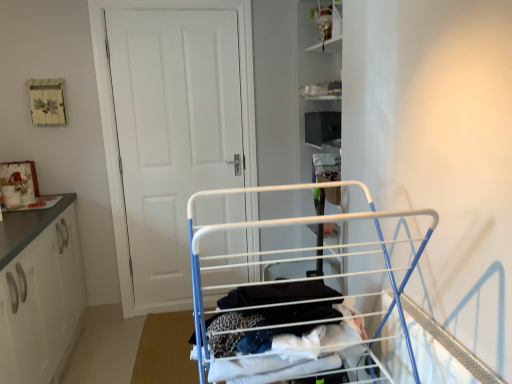
Question: From a real-world perspective, is white metal drying rack at center located higher than white fabric clothes at center?

Choices:
 (A) yes
 (B) no

Answer: (A)

Question: From a real-world perspective, is white metal drying rack at center positioned under white fabric clothes at center based on gravity?

Choices:
 (A) no
 (B) yes

Answer: (A)

Question: Does white metal drying rack at center appear on the left side of white fabric clothes at center?

Choices:
 (A) yes
 (B) no

Answer: (B)

Question: Can you confirm if white metal drying rack at center is taller than white fabric clothes at center?

Choices:
 (A) yes
 (B) no

Answer: (A)

Question: From the image's perspective, is white metal drying rack at center located beneath white fabric clothes at center?

Choices:
 (A) yes
 (B) no

Answer: (B)

Question: Can you confirm if white metal drying rack at center is bigger than white fabric clothes at center?

Choices:
 (A) no
 (B) yes

Answer: (B)

Question: Does white matte cabinet at left have a lesser height compared to white metal drying rack at center?

Choices:
 (A) yes
 (B) no

Answer: (B)

Question: Is white matte cabinet at left to the left of white metal drying rack at center from the viewer's perspective?

Choices:
 (A) no
 (B) yes

Answer: (B)

Question: Does white matte cabinet at left have a smaller size compared to white metal drying rack at center?

Choices:
 (A) no
 (B) yes

Answer: (A)

Question: From the image's perspective, is white matte cabinet at left over white metal drying rack at center?

Choices:
 (A) yes
 (B) no

Answer: (B)

Question: From the image's perspective, would you say white matte cabinet at left is shown under white metal drying rack at center?

Choices:
 (A) no
 (B) yes

Answer: (B)

Question: Is white matte cabinet at left completely or partially outside of white metal drying rack at center?

Choices:
 (A) yes
 (B) no

Answer: (A)

Question: Does matte white cabinet at upper center turn towards white fabric clothes at center?

Choices:
 (A) yes
 (B) no

Answer: (B)